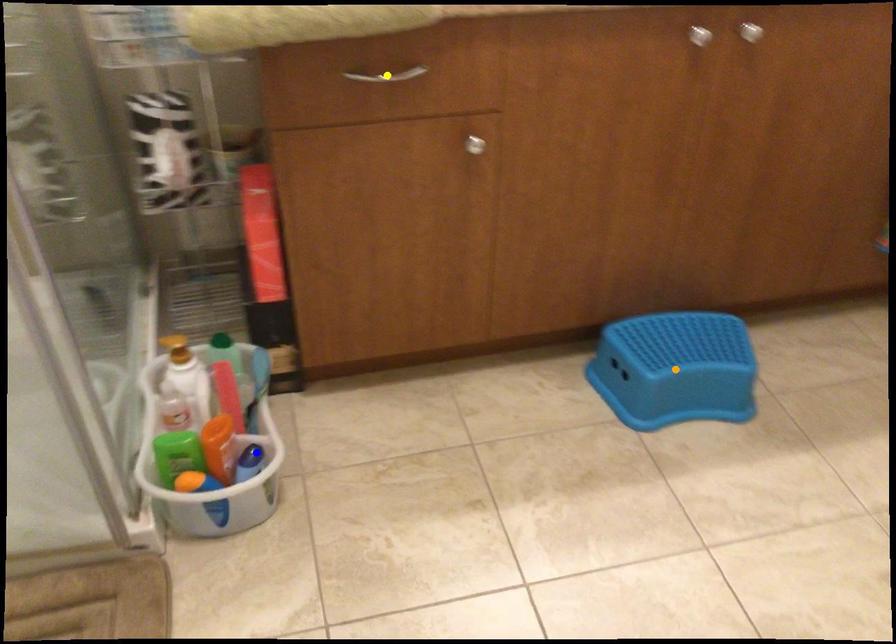
Order these from nearest to farthest:
- blue point
- orange point
- yellow point

orange point < blue point < yellow point